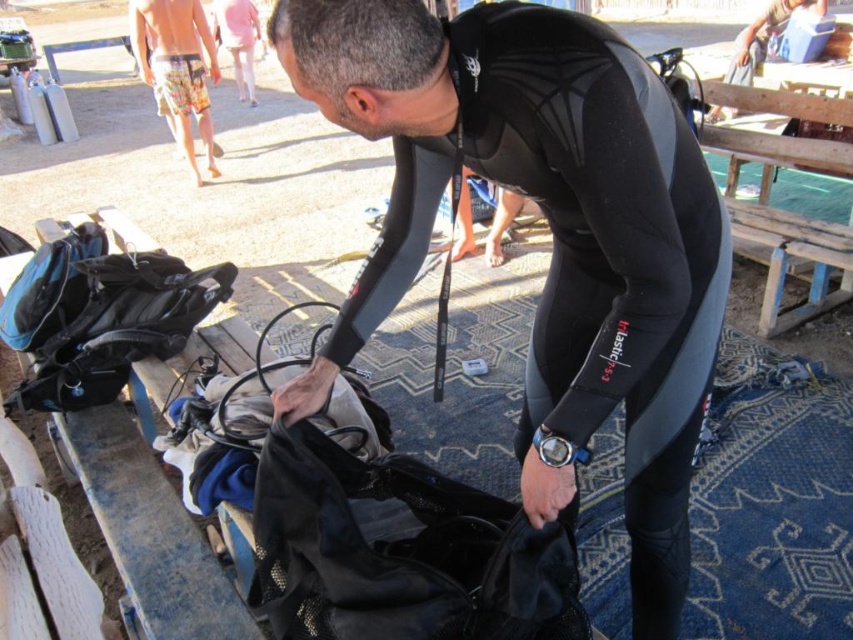
Does point (218, 68) lie behind point (223, 45)?

No, it is not.

In order to click on multicolored board shorts at upper left in this screenshot , I will do `click(177, 67)`.

Can you confirm if black neoprene wetsuit at center is positioned to the right of black mesh bag at center?

Indeed, black neoprene wetsuit at center is positioned on the right side of black mesh bag at center.

Measure the distance from black neoprene wetsuit at center to black mesh bag at center.

A distance of 11.12 inches exists between black neoprene wetsuit at center and black mesh bag at center.

Find the location of a particular element. black neoprene wetsuit at center is located at coordinates (550, 232).

Locate an element on the screen. The width and height of the screenshot is (853, 640). black neoprene wetsuit at center is located at coordinates pos(550,232).

Which of these two, black mesh bag at center or pink fabric pants at upper center, stands taller?

pink fabric pants at upper center is taller.

Consider the image. Who is positioned more to the right, black mesh bag at center or pink fabric pants at upper center?

Positioned to the right is black mesh bag at center.

Identify the location of black mesh bag at center. (401, 552).

Locate an element on the screen. The image size is (853, 640). black mesh bag at center is located at coordinates pos(401,552).